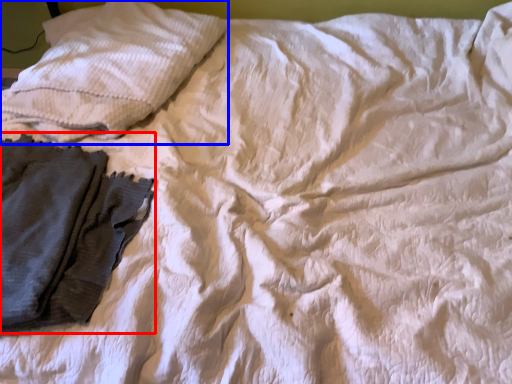
Question: Which object is closer to the camera taking this photo, garment (highlighted by a red box) or pillow (highlighted by a blue box)?

Choices:
 (A) garment
 (B) pillow

Answer: (A)